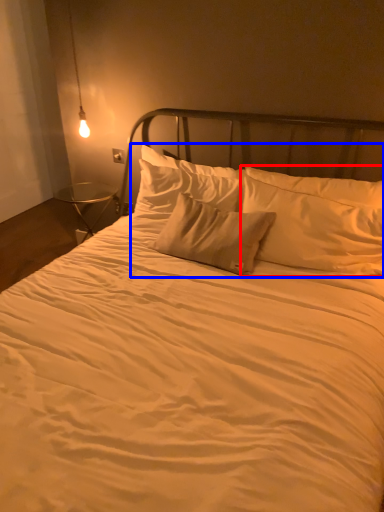
Question: Which object appears farthest to the camera in this image, pillow (highlighted by a red box) or pillow (highlighted by a blue box)?

Choices:
 (A) pillow
 (B) pillow

Answer: (A)